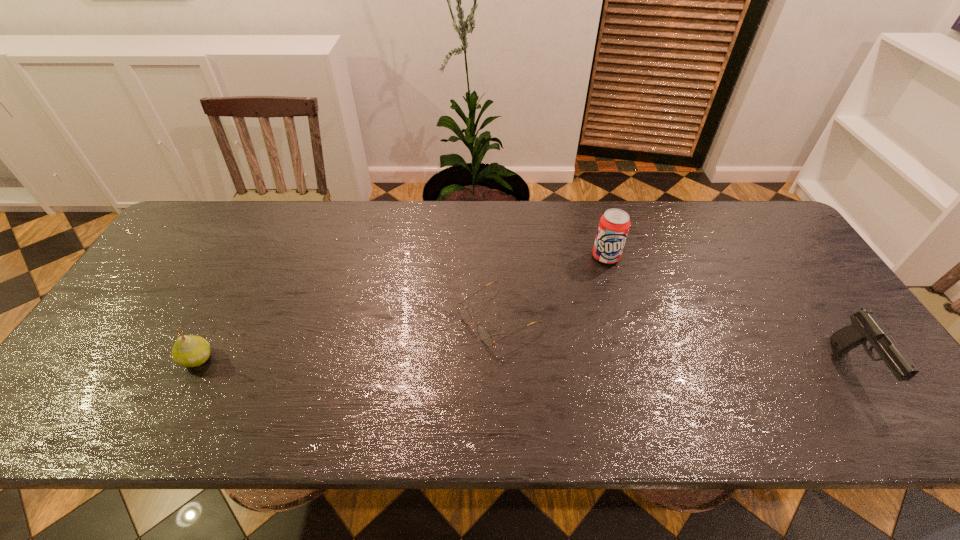
Image resolution: width=960 pixels, height=540 pixels. In order to click on free space on the desktop that is between the leftmost object and the pistol and is positioned on the temples of the spectacles in this screenshot , I will do `click(426, 362)`.

The width and height of the screenshot is (960, 540). What are the coordinates of `vacant spot on the desktop that is between the leftmost object and the pistol and is positioned on the surface of the third object from left to right` in the screenshot? It's located at (590, 364).